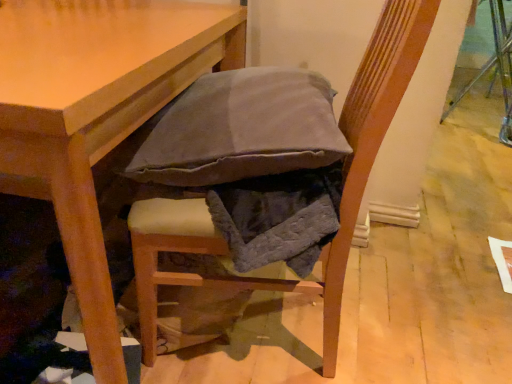
Image resolution: width=512 pixels, height=384 pixels. What are the coordinates of `spots to the right of textured fabric cushion at center` in the screenshot? It's located at (409, 312).